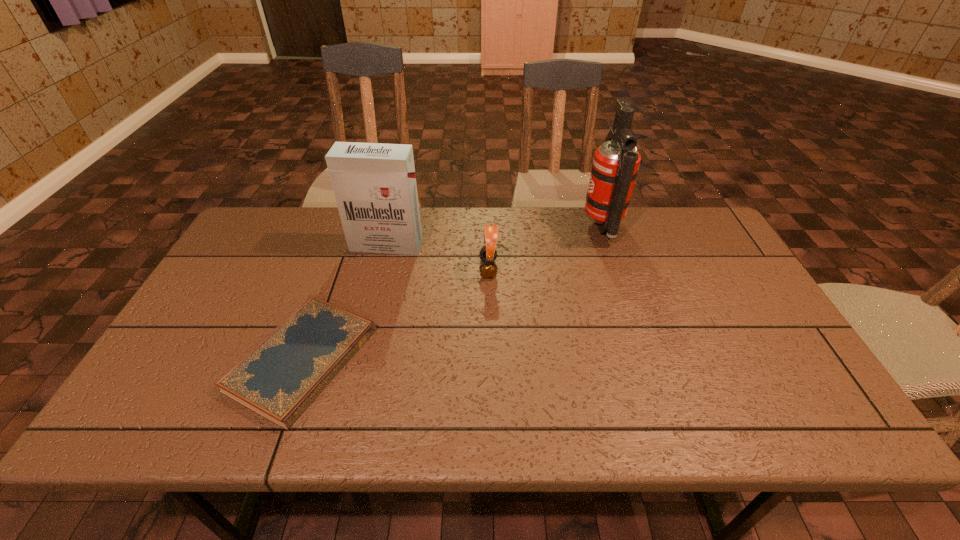
This screenshot has height=540, width=960. I want to click on vacant space that is in between the nearest object and the second tallest object, so click(345, 302).

This screenshot has height=540, width=960. In order to click on free area in between the second tallest object and the second shortest object in this screenshot , I will do `click(437, 256)`.

The height and width of the screenshot is (540, 960). I want to click on vacant area that lies between the third object from left to right and the fire extinguisher, so click(x=545, y=248).

At what (x,y) coordinates should I click in order to perform the action: click on free space between the third shortest object and the third farthest object. Please return your answer as a coordinate pair (x, y). This screenshot has height=540, width=960. Looking at the image, I should click on (437, 256).

Point out which object is positioned as the second nearest to the fire extinguisher. Please provide its 2D coordinates. Your answer should be formatted as a tuple, i.e. [(x, y)], where the tuple contains the x and y coordinates of a point satisfying the conditions above.

[(374, 184)]

Point out which object is positioned as the nearest to the second tallest object. Please provide its 2D coordinates. Your answer should be formatted as a tuple, i.e. [(x, y)], where the tuple contains the x and y coordinates of a point satisfying the conditions above.

[(488, 270)]

Locate an element on the screen. The height and width of the screenshot is (540, 960). free spot that satisfies the following two spatial constraints: 1. on the front label side of the fire extinguisher; 2. on the front side of the third shortest object is located at coordinates (610, 245).

The height and width of the screenshot is (540, 960). What are the coordinates of `vacant space that satisfies the following two spatial constraints: 1. on the ear cups of the third tallest object; 2. on the front side of the shortest object` in the screenshot? It's located at (490, 359).